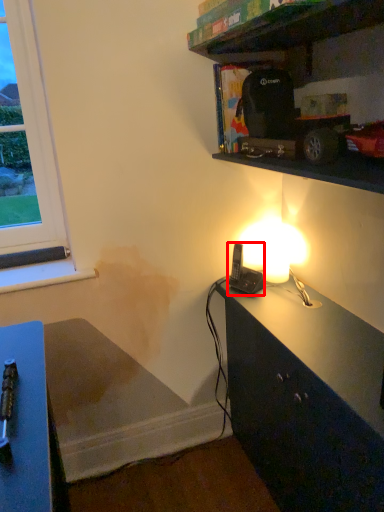
Question: From the image's perspective, what is the correct spatial relationship of equipment (annotated by the red box) in relation to shelf?

Choices:
 (A) above
 (B) below

Answer: (B)